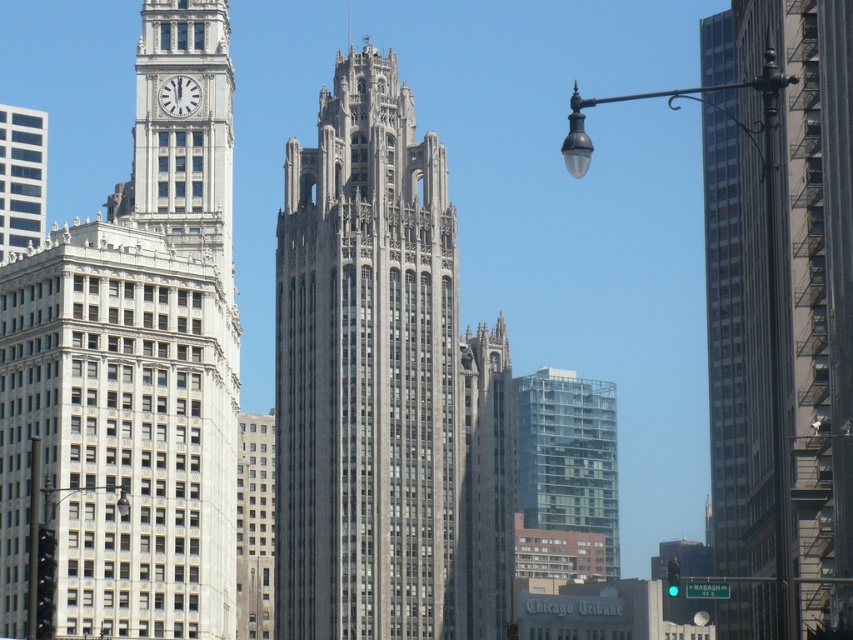
Is gray stone tower at center wider than clear glass building at center?

Indeed, gray stone tower at center has a greater width compared to clear glass building at center.

Which of these two, gray stone tower at center or clear glass building at center, stands shorter?

clear glass building at center is shorter.

Find the location of a particular element. This screenshot has height=640, width=853. gray stone tower at center is located at coordinates (383, 387).

Image resolution: width=853 pixels, height=640 pixels. Find the location of `gray stone tower at center`. gray stone tower at center is located at coordinates click(x=383, y=387).

Is smooth glass skyscraper at right behind matte black streetlight at right?

Yes, smooth glass skyscraper at right is further from the viewer.

Who is more distant from viewer, [798,97] or [740,129]?

Point [740,129]

What do you see at coordinates (779, 289) in the screenshot?
I see `smooth glass skyscraper at right` at bounding box center [779, 289].

The image size is (853, 640). In order to click on smooth glass skyscraper at right in this screenshot , I will do [779, 289].

Does smooth glass skyscraper at right appear over white marble clock at upper left?

No, smooth glass skyscraper at right is not above white marble clock at upper left.

Who is positioned more to the left, smooth glass skyscraper at right or white marble clock at upper left?

white marble clock at upper left is more to the left.

Which is in front, point (780, 301) or point (184, 115)?

Point (184, 115) is in front.

Identify the location of smooth glass skyscraper at right. Image resolution: width=853 pixels, height=640 pixels. (779, 289).